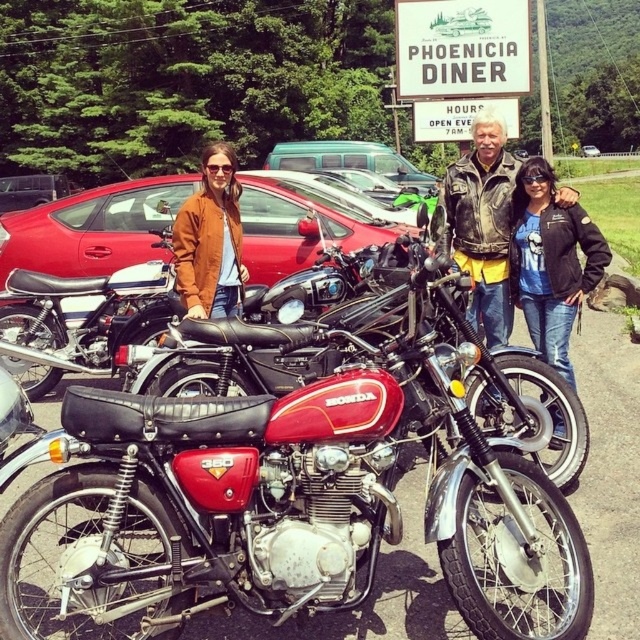
You are a photographer trying to capture a clear shot of the matte brown jacket at center without any obstructions. Given that the shiny red motorcycle at center is blocking the view, can you adjust your position to avoid the motorcycle while still keeping the jacket in frame?

The shiny red motorcycle at center is in front of the matte brown jacket at center, so moving your camera position behind the motorcycle would allow you to see the jacket without obstruction.

You are a photographer trying to adjust the lighting for a photo shoot. You notice two jackets in the center of the scene, a leather jacket at center and a matte brown jacket at center. Which jacket is closer to the camera?

The leather jacket at center is positioned under the matte brown jacket at center, so the matte brown jacket at center is closer to the camera.

Based on the photo, you are standing at the camera position and want to take a photo of the point at coordinates point (x=211, y=157). Is the point within the standard camera frame which has a maximum distance of 20 feet?

The point point (x=211, y=157) is 22.03 feet away from the camera, which exceeds the standard camera frame maximum distance of 20 feet. Therefore, the point is outside the frame.